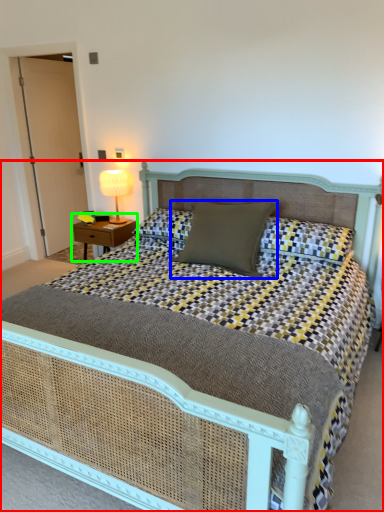
Question: Based on their relative distances, which object is farther from bed (highlighted by a red box)? Choose from pillow (highlighted by a blue box) and nightstand (highlighted by a green box).

Choices:
 (A) pillow
 (B) nightstand

Answer: (B)